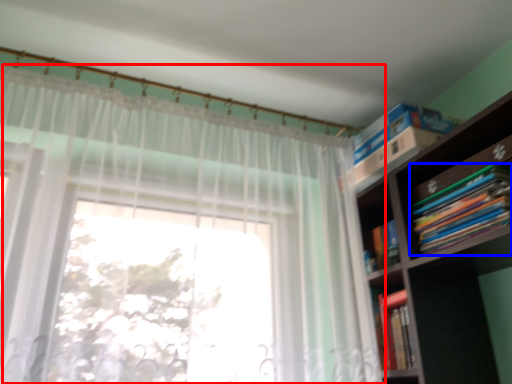
Question: Which object appears closest to the camera in this image, curtain (highlighted by a red box) or book (highlighted by a blue box)?

Choices:
 (A) curtain
 (B) book

Answer: (A)